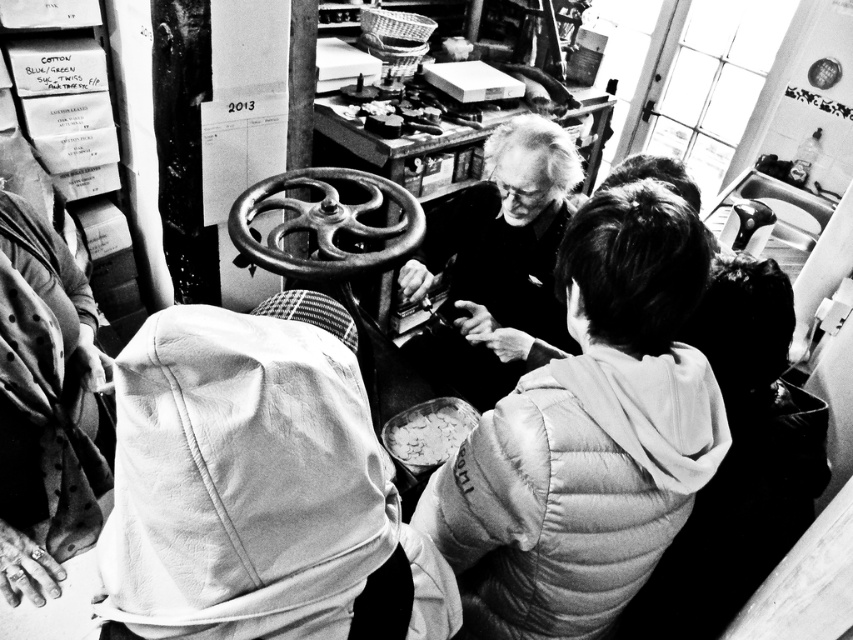
Between point (606, 481) and point (410, 349), which one is positioned behind?

The point (410, 349) is behind.

Is white puffer jacket at center taller than smooth black shirt at center?

Correct, white puffer jacket at center is much taller as smooth black shirt at center.

Measure the distance between white puffer jacket at center and camera.

white puffer jacket at center and camera are 38.68 inches apart.

Identify the location of white puffer jacket at center. Image resolution: width=853 pixels, height=640 pixels. (589, 435).

Does white puffer jacket at center have a lesser height compared to metallic polished wheel at center?

No, white puffer jacket at center is not shorter than metallic polished wheel at center.

Can you confirm if white puffer jacket at center is positioned below metallic polished wheel at center?

Indeed, white puffer jacket at center is positioned under metallic polished wheel at center.

Between point (454, 500) and point (262, 193), which one is positioned in front?

Positioned in front is point (454, 500).

Image resolution: width=853 pixels, height=640 pixels. What are the coordinates of `white puffer jacket at center` in the screenshot? It's located at (589, 435).

Who is lower down, metallic polished wheel at center or smooth white bowl at center?

smooth white bowl at center is lower down.

Consider the image. Does metallic polished wheel at center come in front of smooth white bowl at center?

Yes, it is.

Where is `metallic polished wheel at center`? The height and width of the screenshot is (640, 853). metallic polished wheel at center is located at coordinates (326, 225).